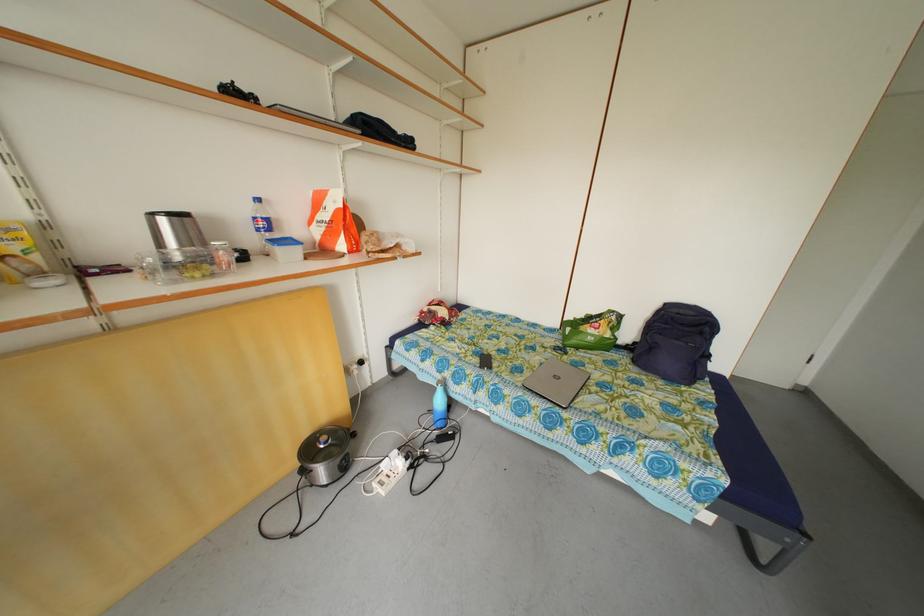
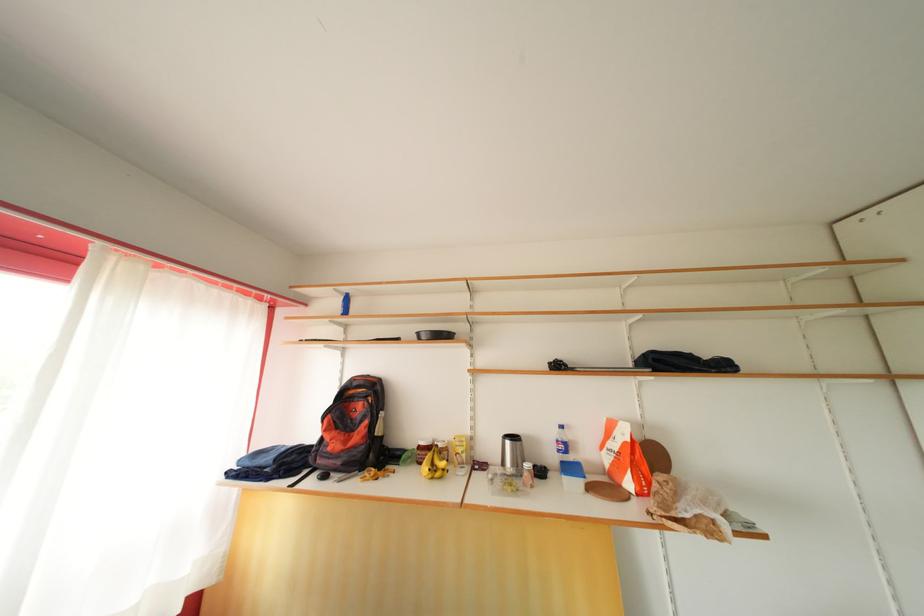
Find the pixel in the second image that matches the point at 257,244 in the first image.

(558, 463)